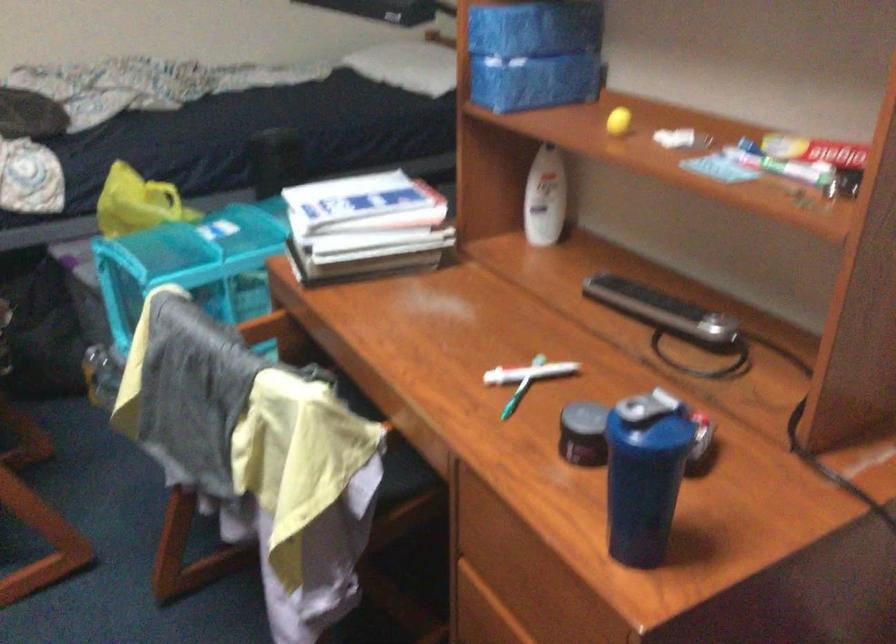
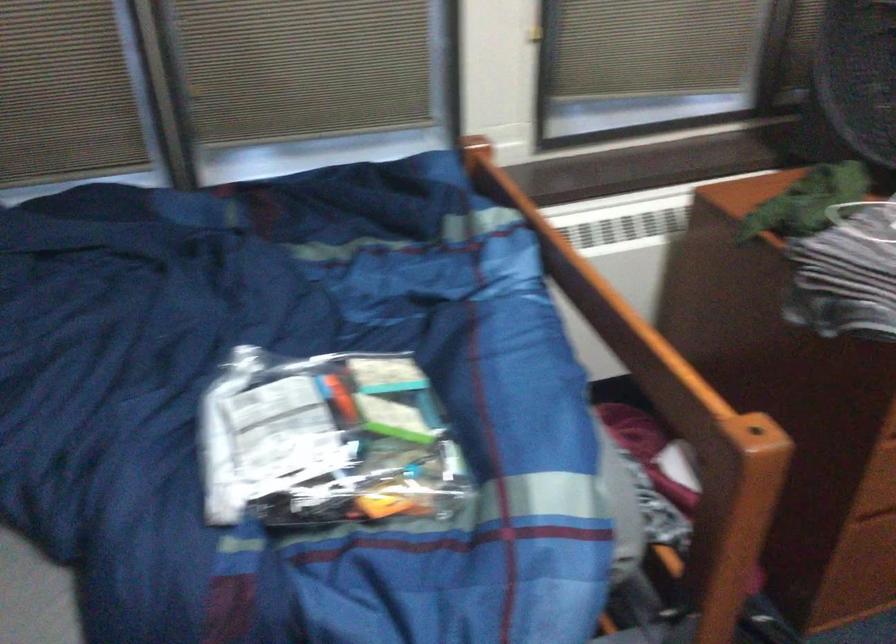
The first image is from the beginning of the video and the second image is from the end. How did the camera likely rotate when shooting the video?

The camera rotated toward left-down.